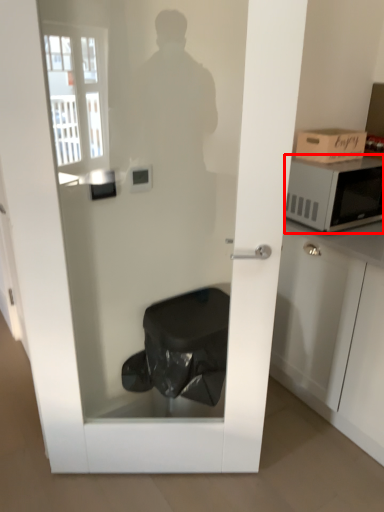
Question: Where is microwave oven (annotated by the red box) located in relation to cardboard box in the image?

Choices:
 (A) left
 (B) right

Answer: (B)